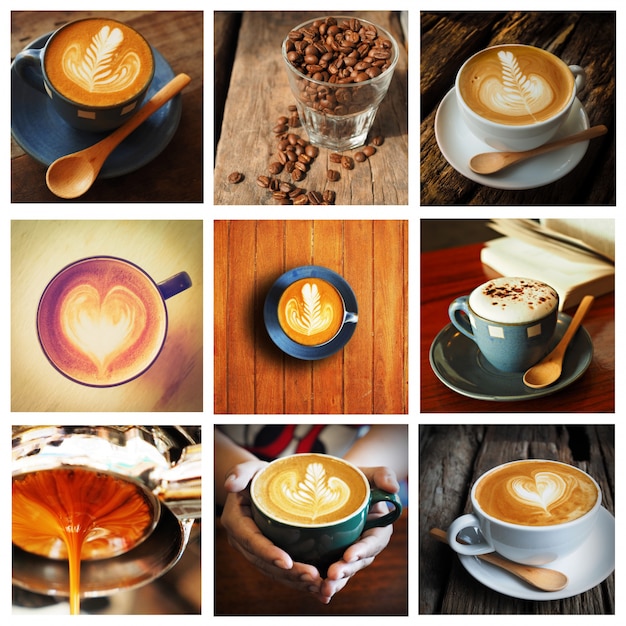
This screenshot has height=626, width=626. I want to click on wooden spoon, so click(79, 165), click(506, 158), click(552, 366), click(536, 572).